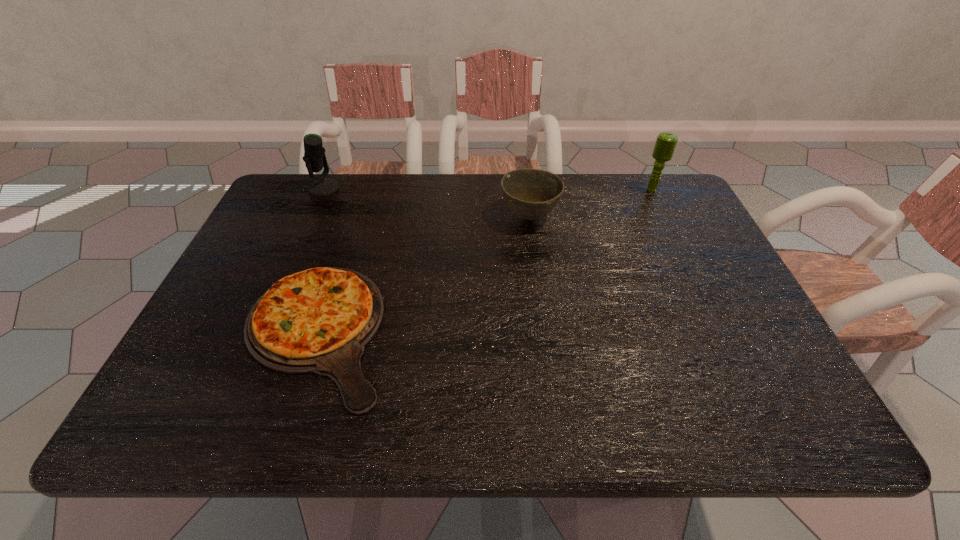
You are a GUI agent. You are given a task and a screenshot of the screen. Output one action in this format:
    pyautogui.click(x=<x>, y=<y>)
    Task: Click on the empty location between the second object from right to left and the pizza
    The width and height of the screenshot is (960, 540).
    Given the screenshot: What is the action you would take?
    pyautogui.click(x=422, y=274)

Locate an element on the screen. This screenshot has height=540, width=960. vacant region between the right microphone and the left microphone is located at coordinates (488, 189).

Find the location of a particular element. vacant space in between the left microphone and the third tallest object is located at coordinates (426, 202).

I want to click on free space between the bowl and the nearest object, so click(x=422, y=274).

Where is `empty location between the third tallest object and the left microphone`? empty location between the third tallest object and the left microphone is located at coordinates (426, 202).

Identify which object is located as the second nearest to the right microphone. Please provide its 2D coordinates. Your answer should be formatted as a tuple, i.e. [(x, y)], where the tuple contains the x and y coordinates of a point satisfying the conditions above.

[(319, 320)]

You are a GUI agent. You are given a task and a screenshot of the screen. Output one action in this format:
    pyautogui.click(x=<x>, y=<y>)
    Task: Click on the object that can be found as the second closest to the nearest object
    
    Given the screenshot: What is the action you would take?
    tap(314, 157)

Image resolution: width=960 pixels, height=540 pixels. I want to click on free region that satisfies the following two spatial constraints: 1. on the front side of the pizza; 2. on the left side of the left microphone, so click(x=259, y=333).